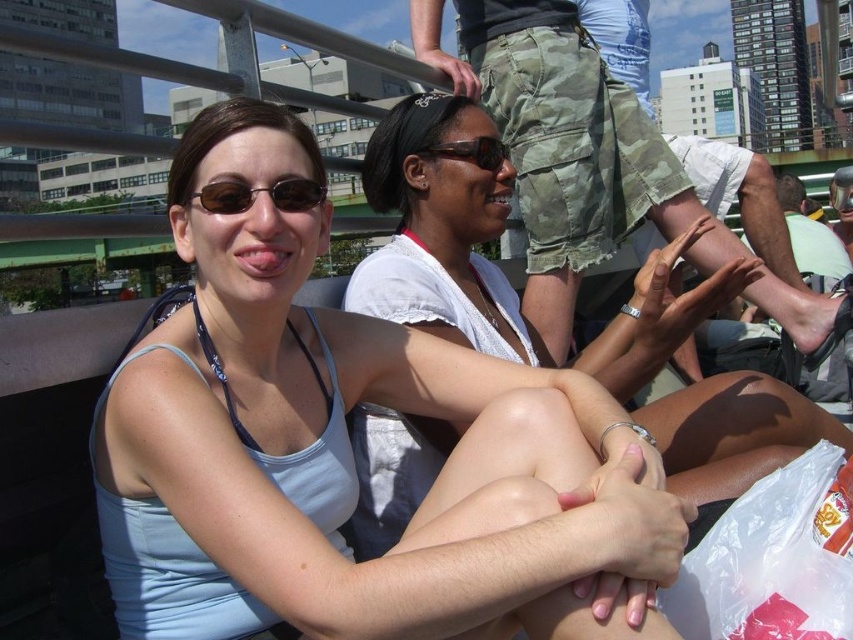
Question: Is white lace top at center to the left of matte brown sunglasses at center from the viewer's perspective?

Choices:
 (A) no
 (B) yes

Answer: (A)

Question: Does white lace top at center lie behind matte brown sunglasses at center?

Choices:
 (A) no
 (B) yes

Answer: (A)

Question: Among these objects, which one is nearest to the camera?

Choices:
 (A) white lace top at center
 (B) sunglasses at center

Answer: (A)

Question: Does light blue fabric tank top at center appear over white lace top at center?

Choices:
 (A) yes
 (B) no

Answer: (B)

Question: Which object is closer to the camera taking this photo?

Choices:
 (A) light blue fabric tank top at center
 (B) white lace top at center

Answer: (A)

Question: Considering the real-world distances, which object is farthest from the sunglasses at center?

Choices:
 (A) light blue fabric tank top at center
 (B) matte brown sunglasses at center
 (C) white lace top at center

Answer: (A)